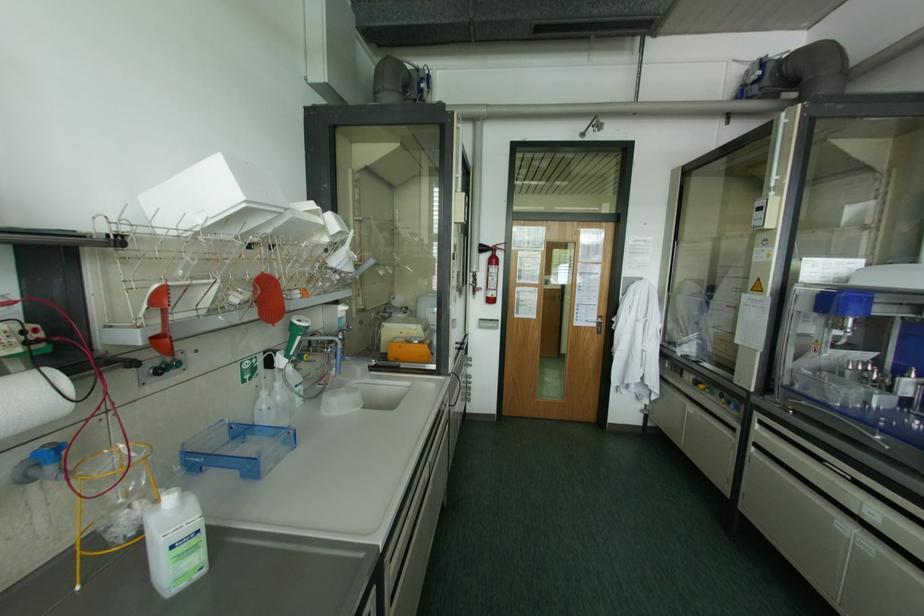
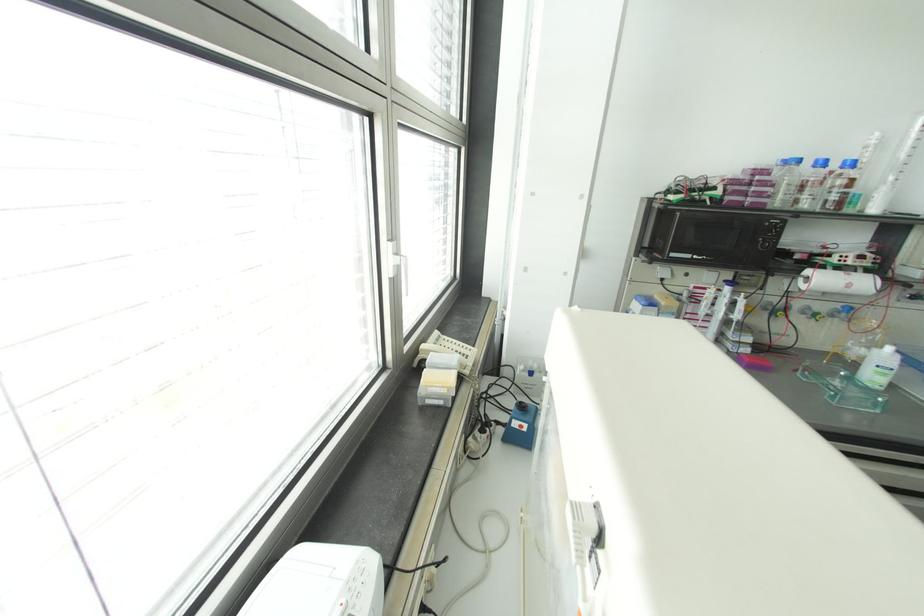
Find the pixel in the second image that matches point (190, 499) in the first image.

(898, 355)